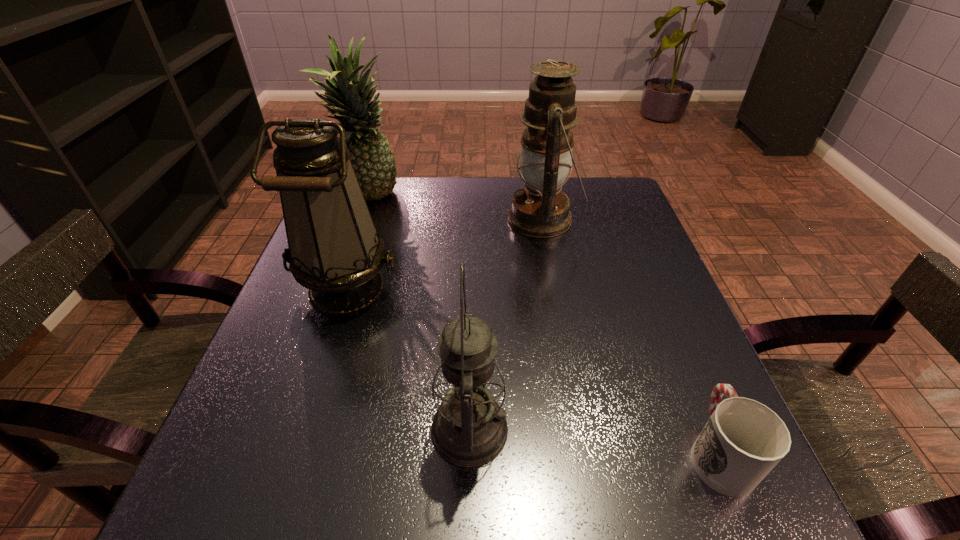
The image size is (960, 540). What are the coordinates of `vacant area that lies between the shortest object and the third object from left to right` in the screenshot? It's located at (593, 441).

Locate which object is the fourth closest to the fourth object from left to right. Please provide its 2D coordinates. Your answer should be formatted as a tuple, i.e. [(x, y)], where the tuple contains the x and y coordinates of a point satisfying the conditions above.

[(743, 440)]

The height and width of the screenshot is (540, 960). Find the location of `object that stands as the closest to the pineapple`. object that stands as the closest to the pineapple is located at coordinates (334, 250).

Point out which oil lamp is positioned as the second nearest to the second oil lamp from left to right. Please provide its 2D coordinates. Your answer should be formatted as a tuple, i.e. [(x, y)], where the tuple contains the x and y coordinates of a point satisfying the conditions above.

[(541, 210)]

Where is `the closest oil lamp to the second farthest oil lamp`? The height and width of the screenshot is (540, 960). the closest oil lamp to the second farthest oil lamp is located at coordinates (469, 429).

At what (x,y) coordinates should I click in order to perform the action: click on free space that satisfies the following two spatial constraints: 1. on the front side of the pineapple; 2. on the left side of the third object from right to left. Please return your answer as a coordinate pair (x, y). Looking at the image, I should click on (x=286, y=430).

Find the location of a particular element. Image resolution: width=960 pixels, height=540 pixels. vacant space that satisfies the following two spatial constraints: 1. on the front side of the second oil lamp from right to left; 2. on the left side of the second farthest oil lamp is located at coordinates (300, 430).